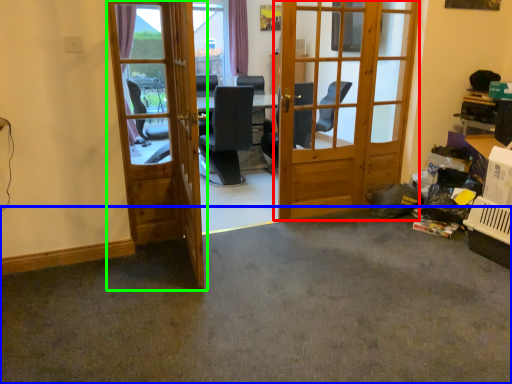
Question: Which is farther away from door (highlighted by a red box)? concrete (highlighted by a blue box) or door (highlighted by a green box)?

Choices:
 (A) concrete
 (B) door

Answer: (A)